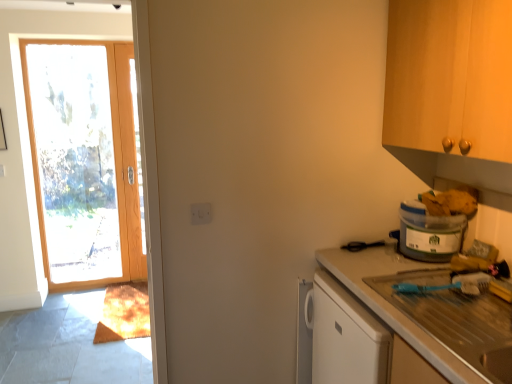
Question: Is white plastic electric outlet at center shorter than translucent plastic container at right?

Choices:
 (A) yes
 (B) no

Answer: (A)

Question: Is white plastic electric outlet at center further to the viewer compared to translucent plastic container at right?

Choices:
 (A) yes
 (B) no

Answer: (A)

Question: Is white plastic electric outlet at center wider than translucent plastic container at right?

Choices:
 (A) yes
 (B) no

Answer: (B)

Question: Is white plastic electric outlet at center bigger than translucent plastic container at right?

Choices:
 (A) no
 (B) yes

Answer: (A)

Question: From a real-world perspective, does white plastic electric outlet at center stand above translucent plastic container at right?

Choices:
 (A) no
 (B) yes

Answer: (B)

Question: Choose the correct answer: Is wooden door at left inside translucent plastic container at right or outside it?

Choices:
 (A) outside
 (B) inside

Answer: (A)

Question: Based on their sizes in the image, would you say wooden door at left is bigger or smaller than translucent plastic container at right?

Choices:
 (A) big
 (B) small

Answer: (A)

Question: From a real-world perspective, is wooden door at left physically located above or below translucent plastic container at right?

Choices:
 (A) above
 (B) below

Answer: (A)

Question: From the image's perspective, is wooden door at left located above or below translucent plastic container at right?

Choices:
 (A) above
 (B) below

Answer: (A)

Question: Is translucent plastic container at right spatially inside wooden door at left, or outside of it?

Choices:
 (A) outside
 (B) inside

Answer: (A)

Question: Based on their sizes in the image, would you say translucent plastic container at right is bigger or smaller than wooden door at left?

Choices:
 (A) small
 (B) big

Answer: (A)

Question: Would you say translucent plastic container at right is to the left or to the right of wooden door at left in the picture?

Choices:
 (A) right
 (B) left

Answer: (A)

Question: Is translucent plastic container at right taller or shorter than wooden door at left?

Choices:
 (A) tall
 (B) short

Answer: (B)

Question: Is translucent plastic container at right bigger or smaller than smooth white countertop at right?

Choices:
 (A) small
 (B) big

Answer: (A)

Question: Is translucent plastic container at right inside or outside of smooth white countertop at right?

Choices:
 (A) outside
 (B) inside

Answer: (A)